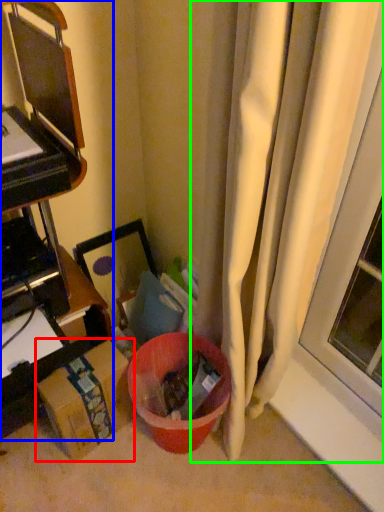
Question: Based on their relative distances, which object is nearer to cardboard box (highlighted by a red box)? Choose from furniture (highlighted by a blue box) and curtain (highlighted by a green box).

Choices:
 (A) furniture
 (B) curtain

Answer: (A)